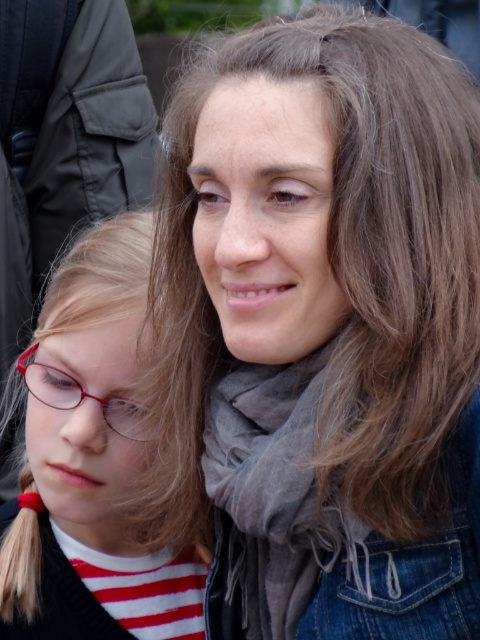
Question: Where is brown matte hair at upper center located in relation to matte red glasses at left in the image?

Choices:
 (A) left
 (B) right

Answer: (B)

Question: Is matte red glasses at left positioned in front of gray soft scarf at center?

Choices:
 (A) no
 (B) yes

Answer: (A)

Question: Which point is farther to the camera?

Choices:
 (A) (248, 38)
 (B) (127, 524)
 (C) (136, 419)
 (D) (288, 621)

Answer: (B)

Question: Which object appears farthest from the camera in this image?

Choices:
 (A) brown matte hair at upper center
 (B) gray soft scarf at center

Answer: (B)

Question: Which object is farther from the camera taking this photo?

Choices:
 (A) matte red glasses at lower left
 (B) brown matte hair at upper center
 (C) matte red glasses at left

Answer: (C)

Question: Does brown matte hair at upper center have a lesser width compared to gray soft scarf at center?

Choices:
 (A) no
 (B) yes

Answer: (A)